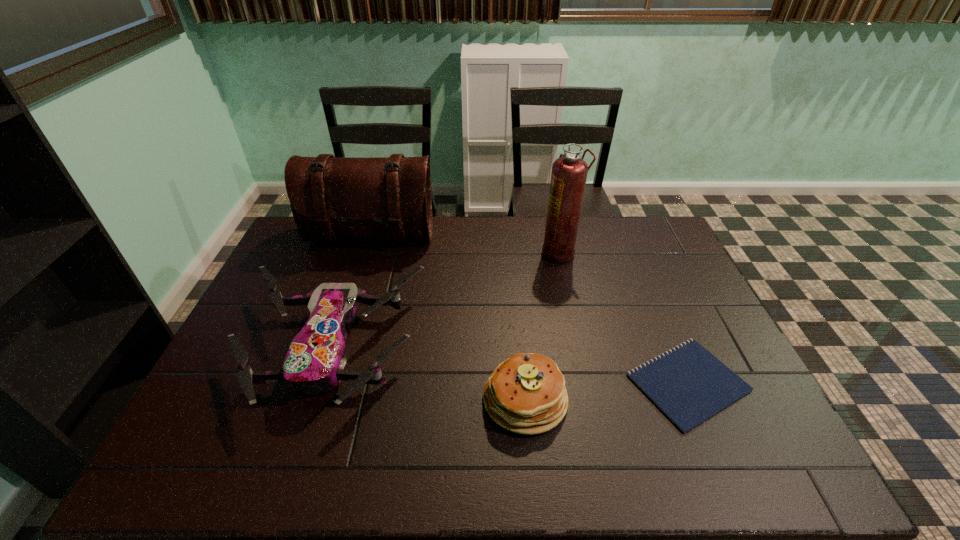
Find the location of a particular element. This screenshot has width=960, height=540. vacant space at the left edge is located at coordinates (231, 385).

Find the location of a particular element. Image resolution: width=960 pixels, height=540 pixels. vacant space at the right edge of the desktop is located at coordinates (735, 402).

At what (x,y) coordinates should I click in order to perform the action: click on vacant space at the near left corner. Please return your answer as a coordinate pair (x, y). The width and height of the screenshot is (960, 540). Looking at the image, I should click on (204, 446).

At what (x,y) coordinates should I click in order to perform the action: click on vacant space at the far right corner of the desktop. Please return your answer as a coordinate pair (x, y). The width and height of the screenshot is (960, 540). Looking at the image, I should click on [643, 249].

Where is `vacant space in between the pancake and the satchel`? vacant space in between the pancake and the satchel is located at coordinates (448, 318).

This screenshot has height=540, width=960. What are the coordinates of `vacant area that lies between the fire extinguisher and the rightmost object` in the screenshot? It's located at (624, 318).

You are a GUI agent. You are given a task and a screenshot of the screen. Output one action in this format:
    pyautogui.click(x=<x>, y=<y>)
    Task: Click on the free space between the pancake and the satchel
    The height and width of the screenshot is (540, 960).
    Given the screenshot: What is the action you would take?
    pyautogui.click(x=448, y=318)

I want to click on vacant area that lies between the pancake and the tallest object, so coord(542,326).

The width and height of the screenshot is (960, 540). I want to click on free spot between the shortest object and the pancake, so click(607, 391).

Locate an element on the screen. vacant space that is in between the shortest object and the satchel is located at coordinates (530, 310).